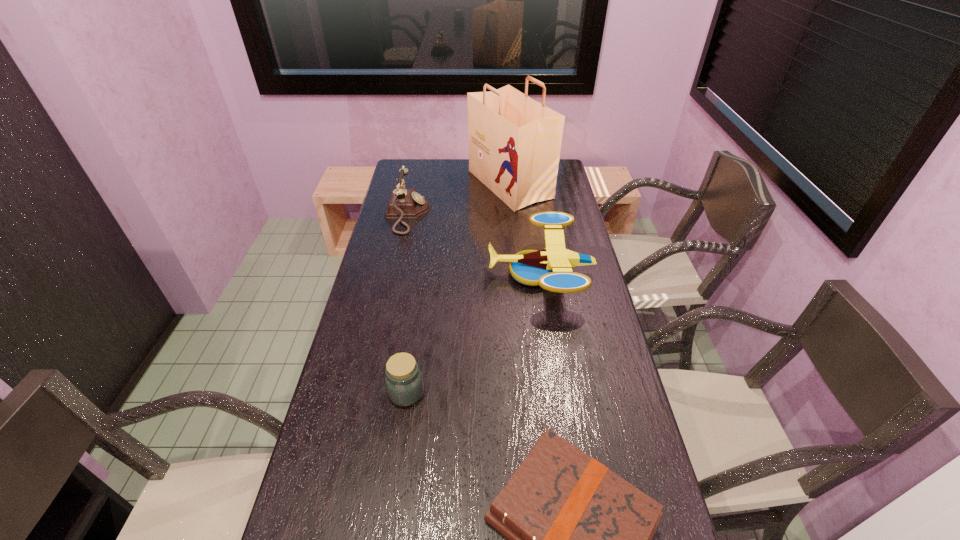
You are a GUI agent. You are given a task and a screenshot of the screen. Output one action in this format:
    pyautogui.click(x=<x>, y=<y>)
    Task: Click on the free space at the far left corner of the desktop
    Image resolution: width=960 pixels, height=540 pixels.
    Given the screenshot: What is the action you would take?
    pyautogui.click(x=406, y=184)

Where is `unoccupied position between the third farthest object and the telephone`? This screenshot has width=960, height=540. unoccupied position between the third farthest object and the telephone is located at coordinates (474, 244).

I want to click on free space that is in between the tallest object and the drone, so click(525, 228).

You are a GUI agent. You are given a task and a screenshot of the screen. Output one action in this format:
    pyautogui.click(x=<x>, y=<y>)
    Task: Click on the free space between the second nearest object and the drone
    
    Given the screenshot: What is the action you would take?
    pyautogui.click(x=473, y=333)

Locate an element on the screen. The height and width of the screenshot is (540, 960). free space between the drone and the grocery bag is located at coordinates (525, 228).

Where is `vacant area that lies between the grocery bag and the telephone`? The image size is (960, 540). vacant area that lies between the grocery bag and the telephone is located at coordinates (459, 199).

Locate an element on the screen. free spot between the third farthest object and the tallest object is located at coordinates (525, 228).

You are a GUI agent. You are given a task and a screenshot of the screen. Output one action in this format:
    pyautogui.click(x=<x>, y=<y>)
    Task: Click on the empty space between the grocery bag and the jar
    
    Given the screenshot: What is the action you would take?
    pyautogui.click(x=458, y=288)

Identify the location of the second closest object to the fourth shortest object. The height and width of the screenshot is (540, 960). (551, 268).

Select which object is the third closest to the grocery bag. Please provide its 2D coordinates. Your answer should be formatted as a tuple, i.e. [(x, y)], where the tuple contains the x and y coordinates of a point satisfying the conditions above.

[(404, 383)]